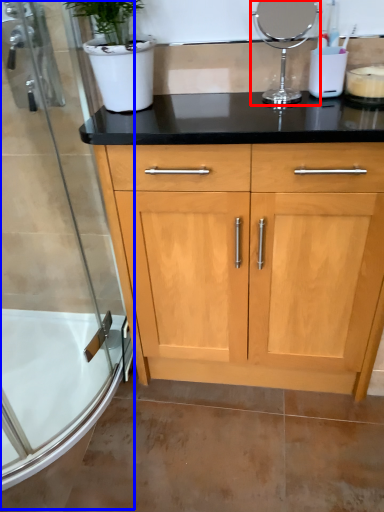
Question: Which object appears farthest to the camera in this image, appliance (highlighted by a red box) or shower door (highlighted by a blue box)?

Choices:
 (A) appliance
 (B) shower door

Answer: (A)